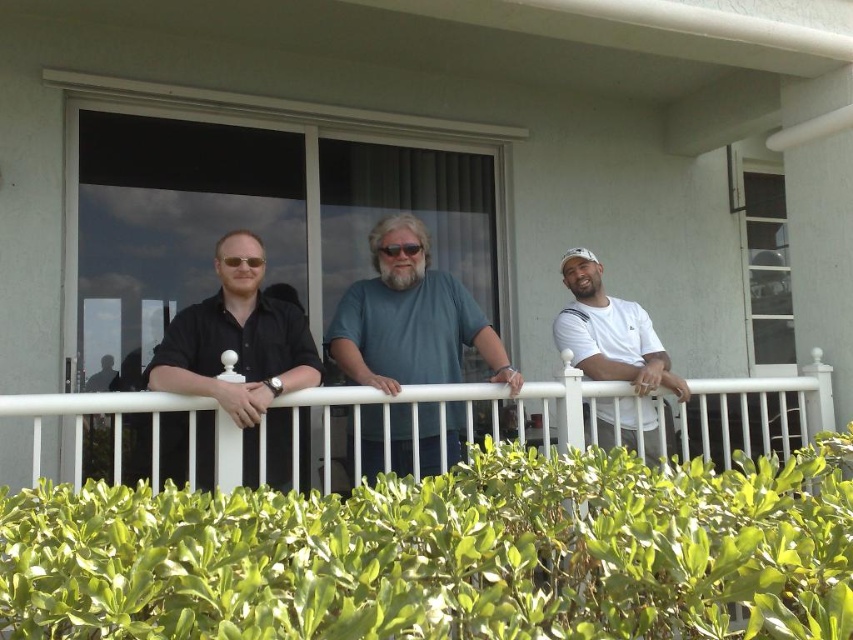
Can you confirm if white metal railing at center is positioned to the right of teal matte shirt at center?

Indeed, white metal railing at center is positioned on the right side of teal matte shirt at center.

Where is `white metal railing at center`? white metal railing at center is located at coordinates (125, 432).

Does matte black shirt at center have a larger size compared to white matte t-shirt at center?

Yes.

Is point (234, 328) positioned in front of point (625, 333)?

Yes, it is in front of point (625, 333).

This screenshot has height=640, width=853. What are the coordinates of `matte black shirt at center` in the screenshot? It's located at (241, 355).

Who is shorter, teal matte shirt at center or white matte t-shirt at center?

Standing shorter between the two is white matte t-shirt at center.

Between point (410, 380) and point (589, 353), which one is positioned behind?

Positioned behind is point (589, 353).

This screenshot has height=640, width=853. Describe the element at coordinates (410, 317) in the screenshot. I see `teal matte shirt at center` at that location.

Image resolution: width=853 pixels, height=640 pixels. I want to click on teal matte shirt at center, so click(x=410, y=317).